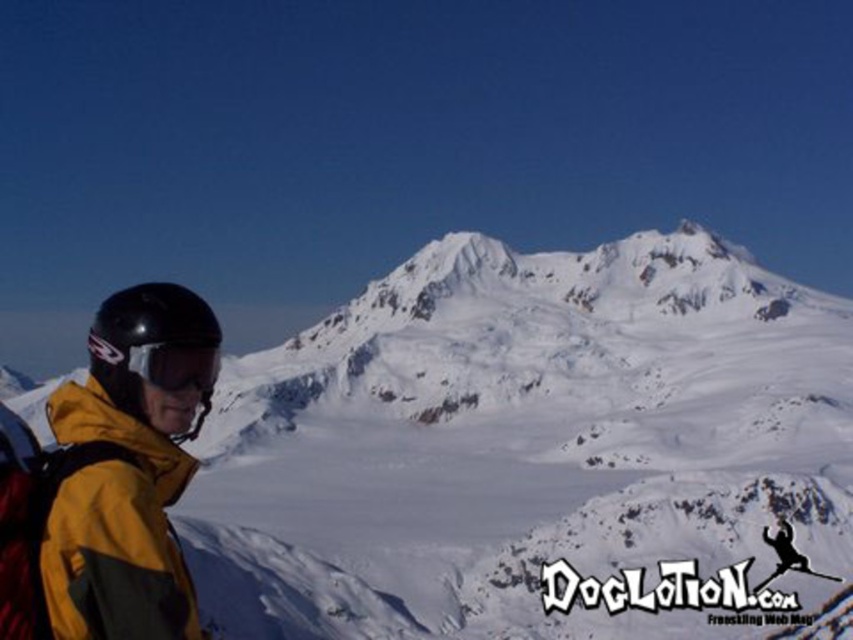
You are a photographer trying to capture the reflection of the matte black goggles at left in the snow. Where should you look on the snow to find the reflection?

The reflection of the matte black goggles at left would be directly below it on the snow at point [175,365].

You are a photographer trying to capture the snowy mountain scene. You notice the yellow matte jacket at lower left and the shiny black ski at lower right. Which object should you focus on first if you want to include both in your shot without moving the camera?

You should focus on the yellow matte jacket at lower left first because it is positioned to the left of the shiny black ski at lower right, ensuring both are within the frame when centered appropriately.